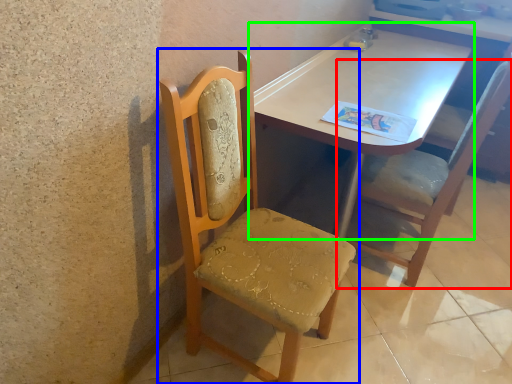
Question: Estimate the real-world distances between objects in this image. Which object is closer to chair (highlighted by a red box), chair (highlighted by a blue box) or table (highlighted by a green box)?

Choices:
 (A) chair
 (B) table

Answer: (B)